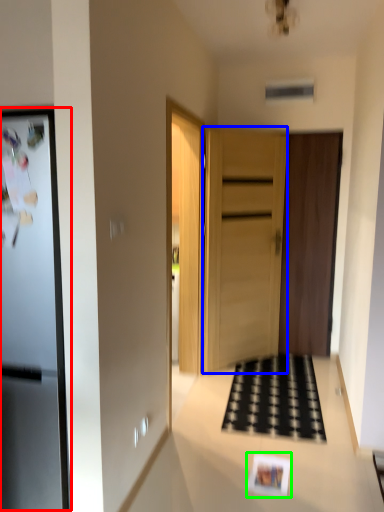
Question: Which object is positioned farthest from fridge (highlighted by a red box)? Select from door (highlighted by a blue box) and postcard (highlighted by a green box).

Choices:
 (A) door
 (B) postcard

Answer: (A)